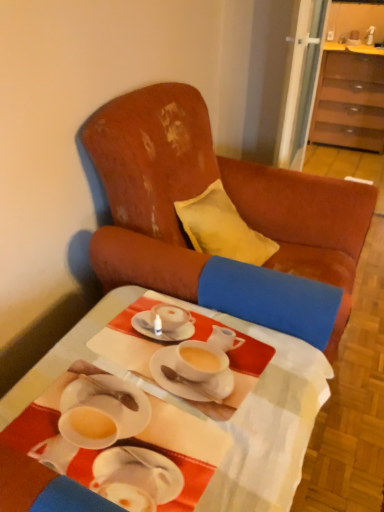
Question: Could you tell me if white glossy table at center is turned towards distressed leather armchair at center?

Choices:
 (A) no
 (B) yes

Answer: (A)

Question: Is white glossy table at center taller than distressed leather armchair at center?

Choices:
 (A) yes
 (B) no

Answer: (B)

Question: Is white glossy table at center to the left of distressed leather armchair at center from the viewer's perspective?

Choices:
 (A) no
 (B) yes

Answer: (B)

Question: From the image's perspective, does white glossy table at center appear higher than distressed leather armchair at center?

Choices:
 (A) no
 (B) yes

Answer: (A)

Question: Considering the relative sizes of white glossy table at center and distressed leather armchair at center in the image provided, is white glossy table at center shorter than distressed leather armchair at center?

Choices:
 (A) no
 (B) yes

Answer: (B)

Question: Is distressed leather armchair at center bigger or smaller than brown wood cabinet at upper right?

Choices:
 (A) big
 (B) small

Answer: (A)

Question: From a real-world perspective, is distressed leather armchair at center physically located above or below brown wood cabinet at upper right?

Choices:
 (A) below
 (B) above

Answer: (B)

Question: Is distressed leather armchair at center to the left or to the right of brown wood cabinet at upper right in the image?

Choices:
 (A) right
 (B) left

Answer: (B)

Question: Is distressed leather armchair at center taller or shorter than brown wood cabinet at upper right?

Choices:
 (A) tall
 (B) short

Answer: (A)

Question: Based on their positions, is brown wood cabinet at upper right located to the left or right of white glossy table at center?

Choices:
 (A) right
 (B) left

Answer: (A)

Question: From a real-world perspective, is brown wood cabinet at upper right physically located above or below white glossy table at center?

Choices:
 (A) below
 (B) above

Answer: (B)

Question: From the image's perspective, is brown wood cabinet at upper right above or below white glossy table at center?

Choices:
 (A) below
 (B) above

Answer: (B)

Question: Is brown wood cabinet at upper right in front of or behind white glossy table at center in the image?

Choices:
 (A) front
 (B) behind

Answer: (B)

Question: Is brown wood cabinet at upper right wider or thinner than distressed leather armchair at center?

Choices:
 (A) wide
 (B) thin

Answer: (B)

Question: Do you think brown wood cabinet at upper right is within distressed leather armchair at center, or outside of it?

Choices:
 (A) inside
 (B) outside

Answer: (B)